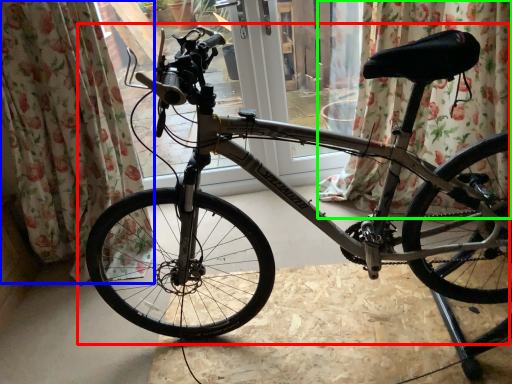
Question: Which object is the farthest from bicycle (highlighted by a red box)? Choose among these: curtain (highlighted by a blue box) or curtain (highlighted by a green box).

Choices:
 (A) curtain
 (B) curtain

Answer: (B)